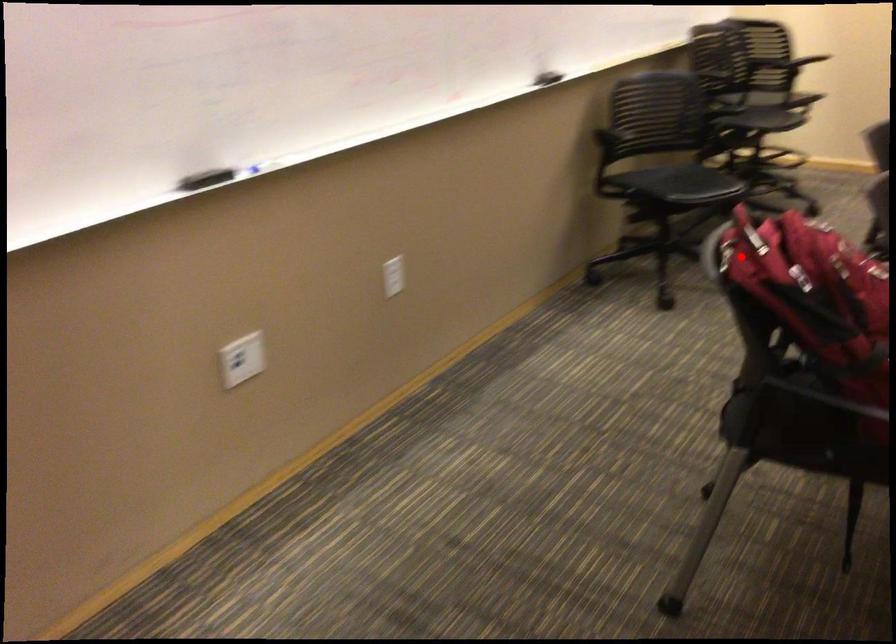
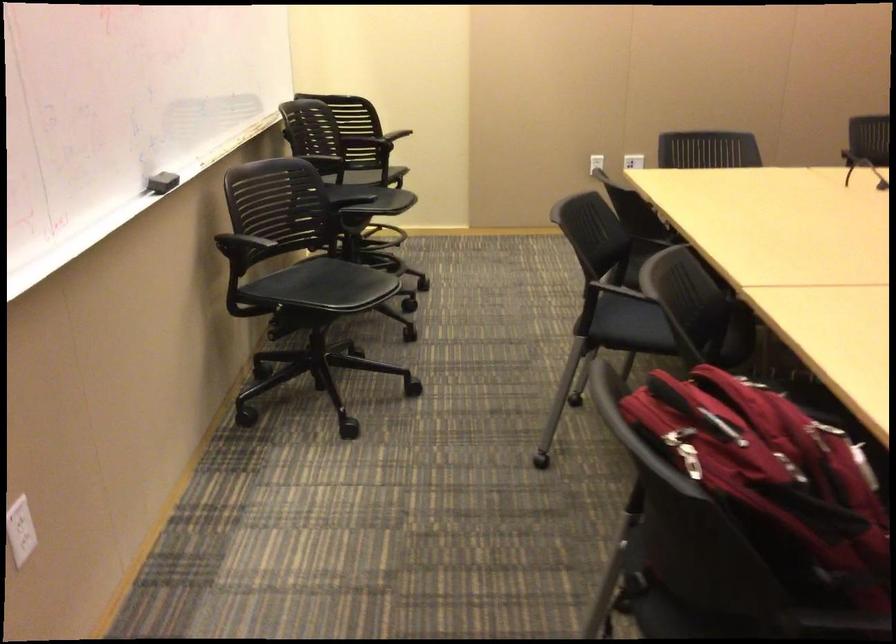
Find the pixel in the second image that matches the highlighted location in the first image.

(690, 460)